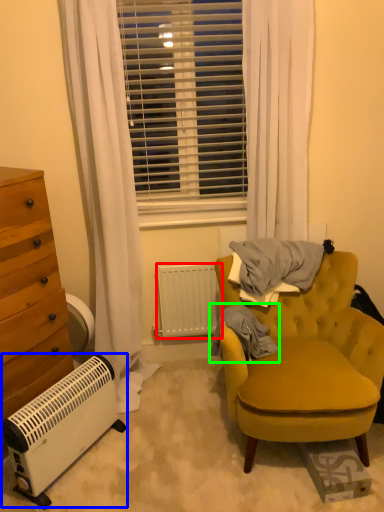
Question: Estimate the real-world distances between objects in this image. Which object is farther from radiator (highlighted by a red box), air conditioning (highlighted by a blue box) or blanket (highlighted by a green box)?

Choices:
 (A) air conditioning
 (B) blanket

Answer: (A)